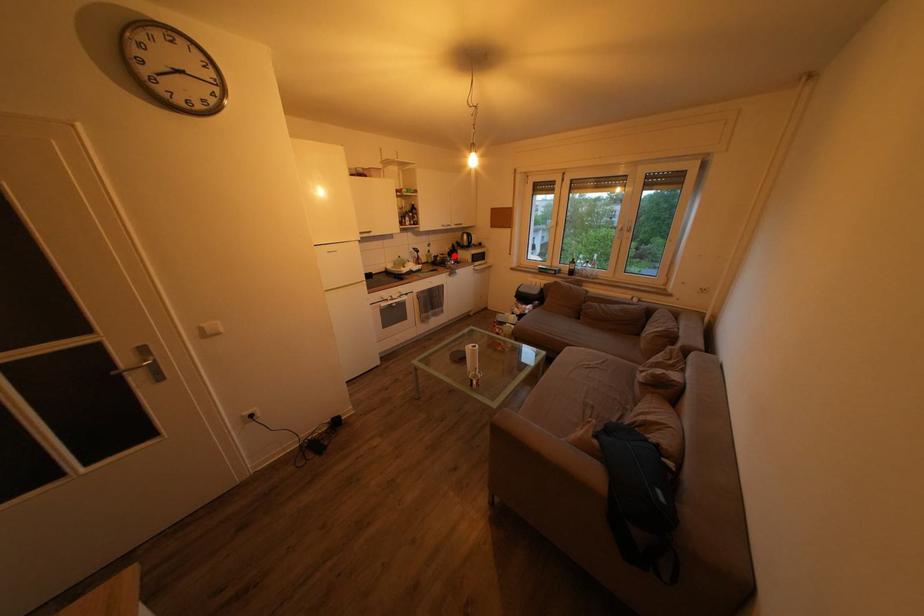
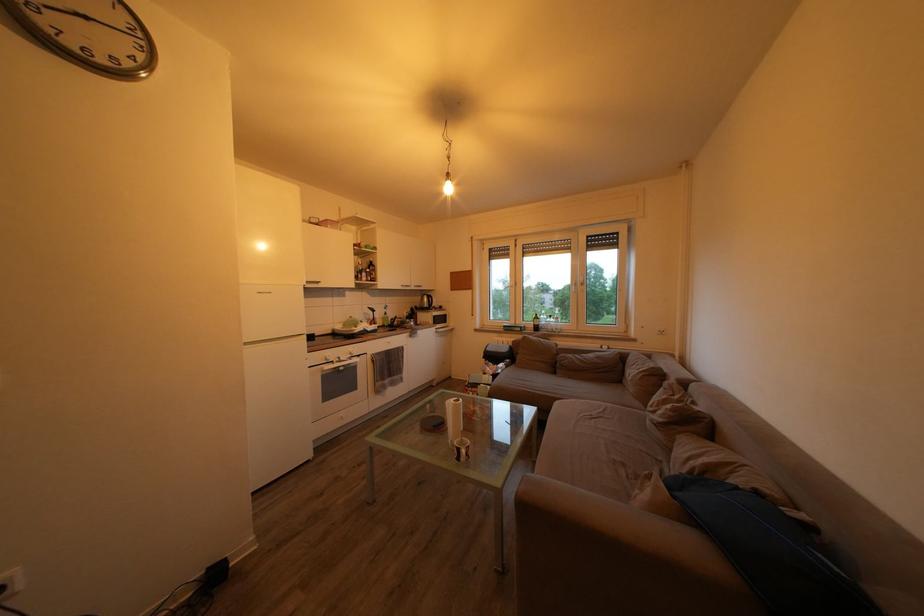
In the second image, find the point that corresponds to the highlighted location in the first image.

(412, 318)